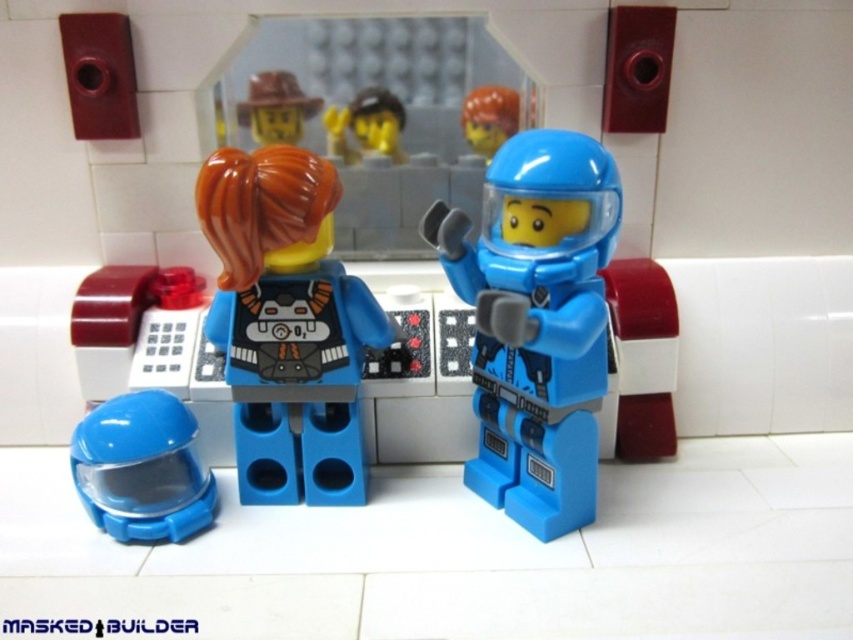
Please look at the LEGO scene. There are two figures in blue spacesuits. One has a transparent helmet and the other has a solid blue helmet. The figure on the left is facing away, showing a black and white pattern on its back. The figure on the right is facing towards us. Now, there is a point marked at coordinates (287, 324). What object is located at that point?

At point (287, 324) lies translucent orange hair at center.

You are a LEGO figure with a height of 4.5 centimeters. You want to reach the translucent orange hair at center from your current position. Can you stretch your arm to touch it without moving your body?

The distance between you and the translucent orange hair at center is 77.33 centimeters, which is greater than your 4.5 centimeter height. Since your arm length is likely shorter than your height, you cannot reach it without moving.